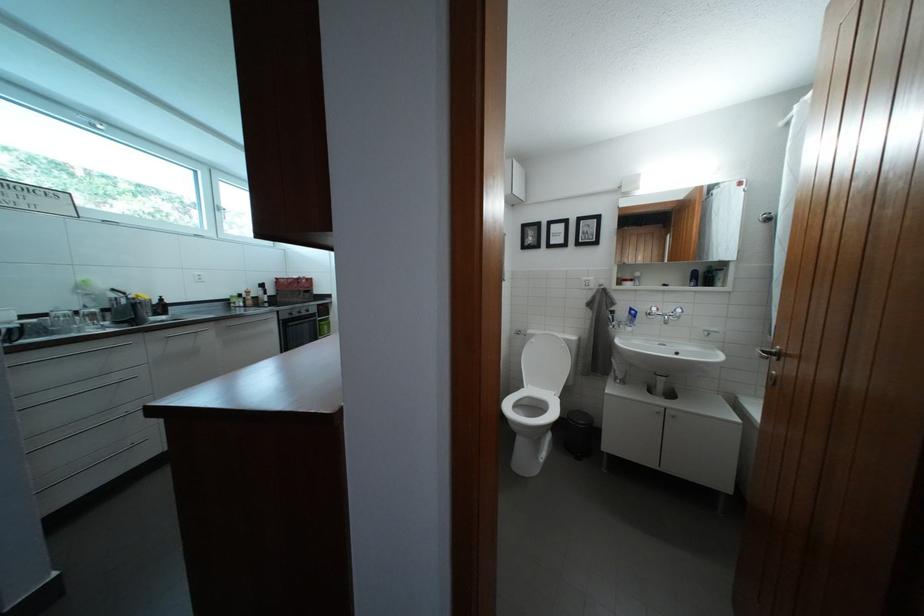
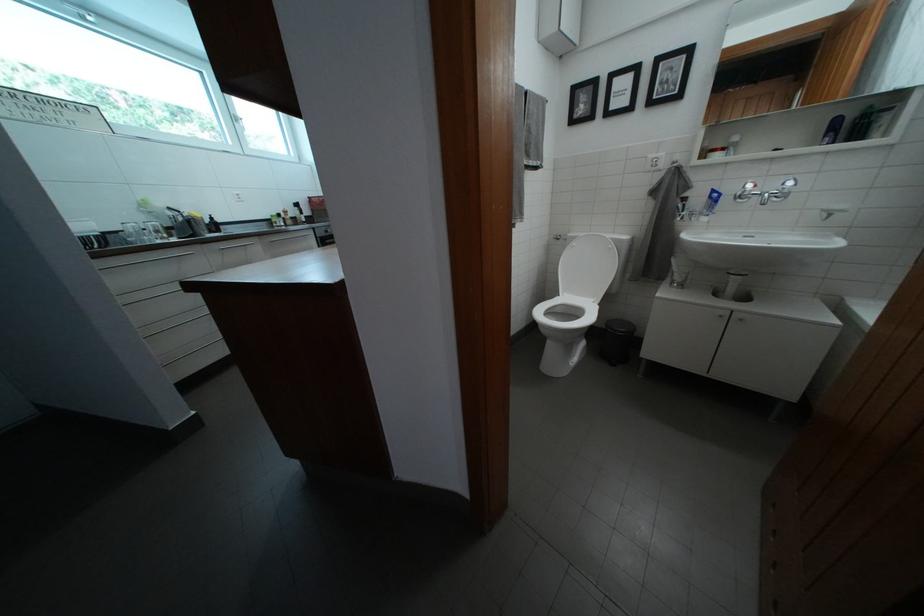
Question: The images are taken continuously from a first-person perspective. In which direction is your viewpoint rotating?

Choices:
 (A) Left
 (B) Right
 (C) Up
 (D) Down

Answer: (D)